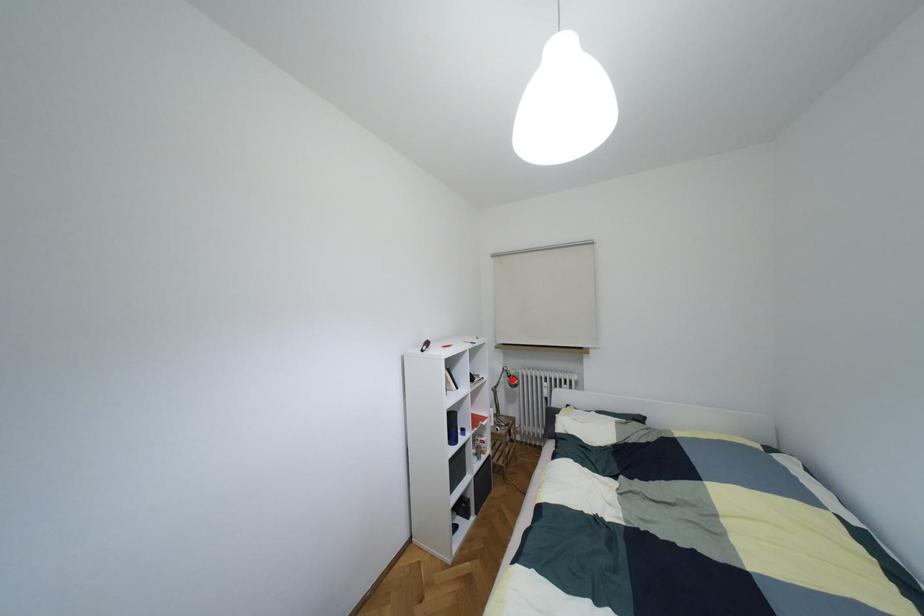
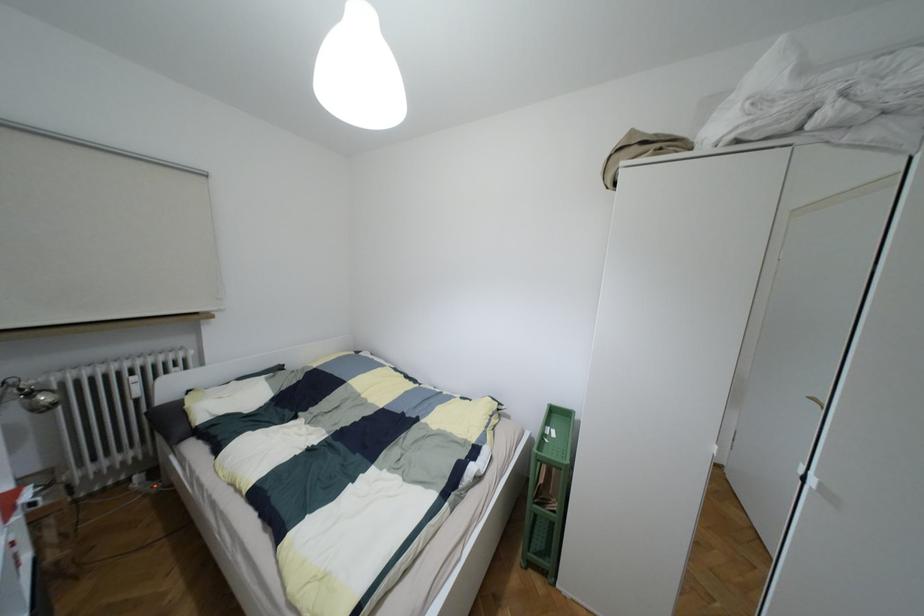
In the second image, find the point that corresponds to the highlighted location in the first image.

(43, 397)